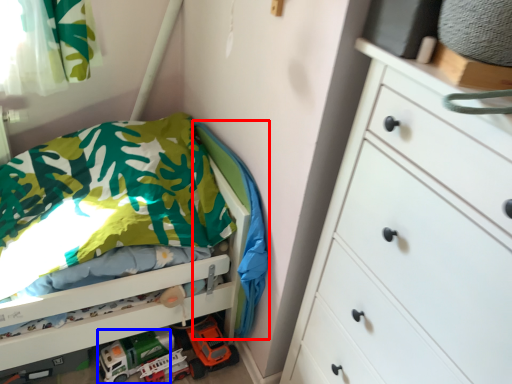
Question: Among these objects, which one is farthest to the camera, blanket (highlighted by a red box) or toy car (highlighted by a blue box)?

Choices:
 (A) blanket
 (B) toy car

Answer: (B)